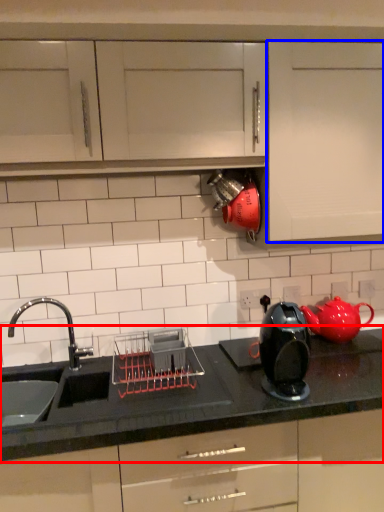
Question: Which of the following is the closest to the observer, countertop (highlighted by a red box) or cabinetry (highlighted by a blue box)?

Choices:
 (A) countertop
 (B) cabinetry

Answer: (A)